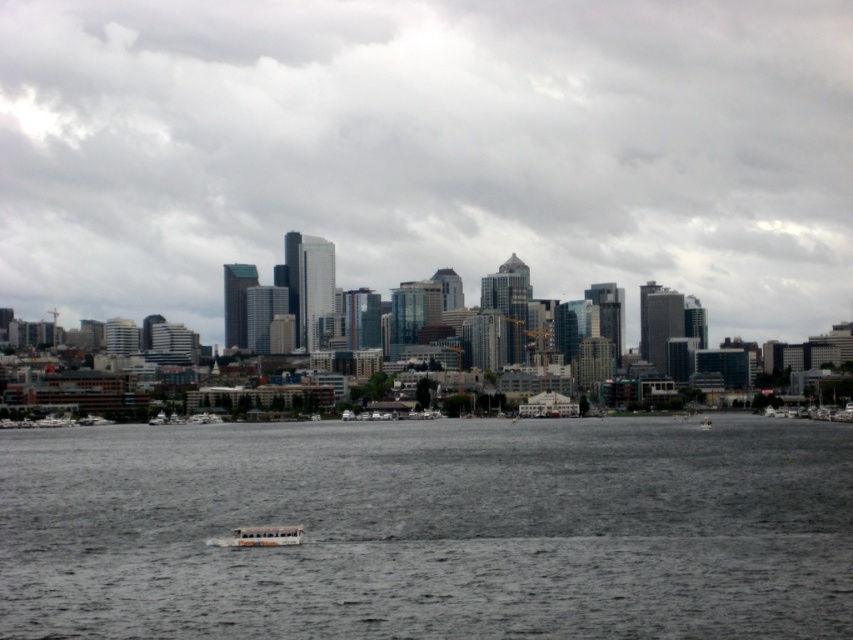
You are a drone operator tasked with capturing aerial footage of the transparent glass skyscrapers at center and the gray water at center. Your drone has a maximum flight range of 70 meters. Can your drone capture both locations in a single flight without needing to recharge?

The transparent glass skyscrapers at center and gray water at center are 72.68 meters apart from each other. Since the drone can only fly up to 70 meters, it cannot capture both locations in a single flight without needing to recharge.

You are standing on the dock and see two white plastic boats in the water. Which boat is nearer to you, the white plastic boat at lower center or the white plastic boat at center?

The white plastic boat at lower center is closer to the viewer than the white plastic boat at center, so the white plastic boat at lower center is nearer to you.

You are standing on the dock and looking at the image. There is a point marked at coordinates point (430, 529). What is located at that point?

The gray water at center is located at point (430, 529).